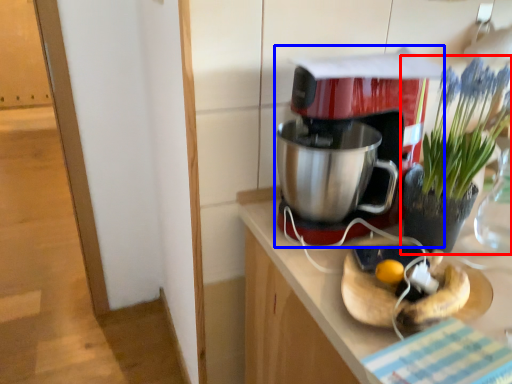
Question: Which object is closer to the camera taking this photo, houseplant (highlighted by a red box) or coffee maker (highlighted by a blue box)?

Choices:
 (A) houseplant
 (B) coffee maker

Answer: (A)